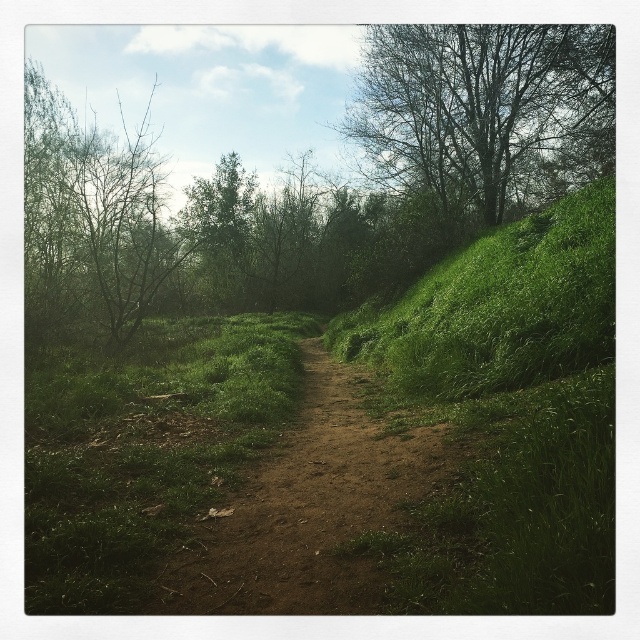
Question: Is dirt path at center further to camera compared to bare branches at left?

Choices:
 (A) no
 (B) yes

Answer: (A)

Question: Which is nearer to the green leafy tree at upper center?

Choices:
 (A) green leafy tree at upper right
 (B) bare branches at left

Answer: (B)

Question: Does bare branches at left have a smaller size compared to green leafy tree at upper center?

Choices:
 (A) no
 (B) yes

Answer: (A)

Question: Can you confirm if dirt path at center is positioned to the left of green leafy tree at upper center?

Choices:
 (A) no
 (B) yes

Answer: (A)

Question: Which point appears closest to the camera in this image?

Choices:
 (A) (340, 522)
 (B) (252, 179)

Answer: (A)

Question: Estimate the real-world distances between objects in this image. Which object is farther from the green leafy tree at upper center?

Choices:
 (A) dirt path at center
 (B) green leafy tree at upper right

Answer: (A)